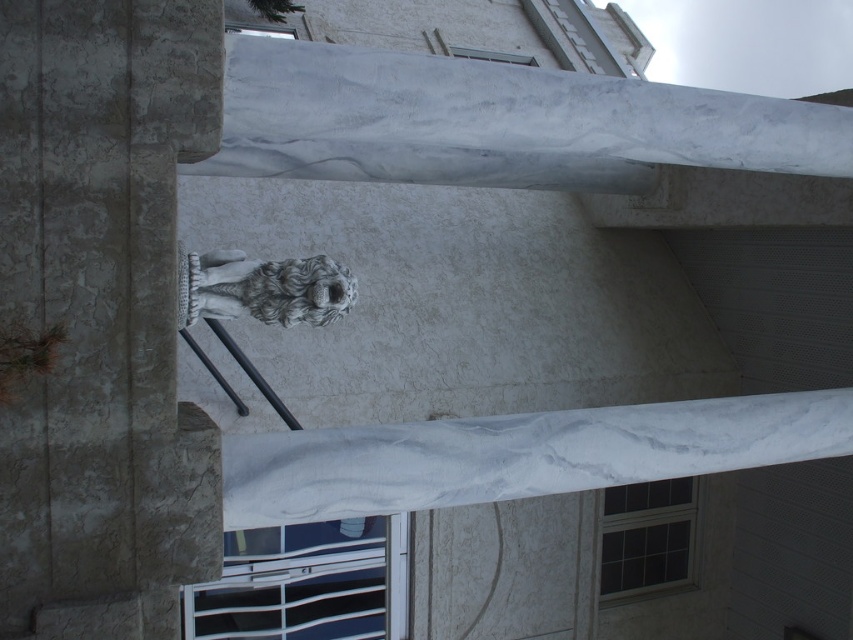
You are a painter standing 2 meters away from the white marble column at center and the gray stone owl at center. You want to paint both objects without moving your easel. Can you fit both into your field of view if your field of view is 1.5 meters wide?

The distance between the white marble column at center and the gray stone owl at center is 1.28 meters, which is less than your field of view of 1.5 meters. Therefore, you can fit both into your field of view without moving your easel.

You are standing in front of the building and want to take a photo of the white marble column at center. If your camera can focus on objects up to 15 feet away, will it be able to capture the column clearly?

The white marble column at center is 16.62 feet away from the camera, which is beyond the camera focus limit of 15 feet. Therefore, the camera may not capture the column clearly.

You are an architect examining the building exterior. You notice the white marble column at center and the gray stone owl at center. Which object is located to the left of the other?

The white marble column at center is positioned on the left side of gray stone owl at center.